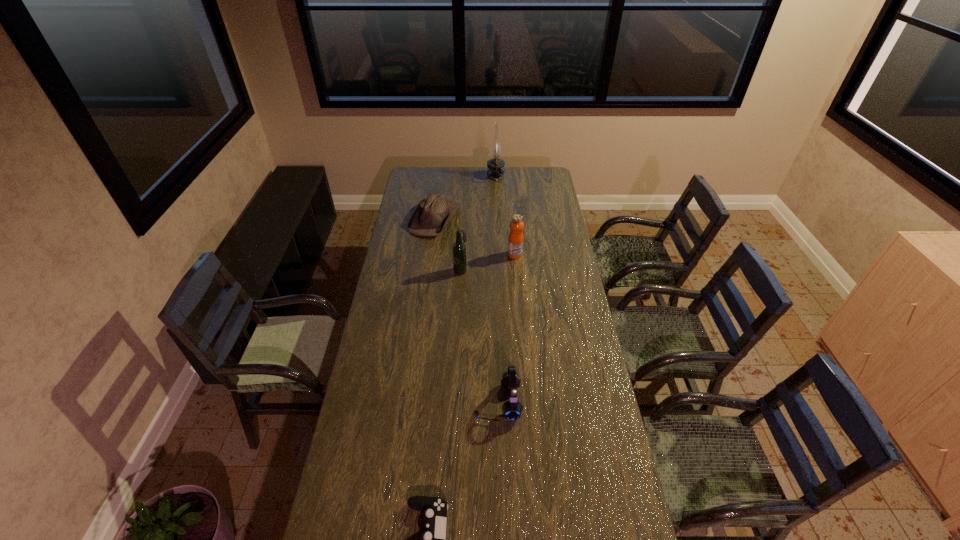
At what (x,y) coordinates should I click in order to perform the action: click on oil lamp. Please return your answer as a coordinate pair (x, y). Looking at the image, I should click on (495, 170).

Find the location of a particular element. the tallest object is located at coordinates (495, 170).

At what (x,y) coordinates should I click in order to perform the action: click on beer bottle. Please return your answer as a coordinate pair (x, y). Looking at the image, I should click on (459, 249).

Where is `fruit juice`? This screenshot has width=960, height=540. fruit juice is located at coordinates (515, 242).

Identify the location of headset. (512, 409).

You are a GUI agent. You are given a task and a screenshot of the screen. Output one action in this format:
    pyautogui.click(x=<x>, y=<y>)
    Task: Click on the fifth farthest object
    Image resolution: width=960 pixels, height=540 pixels.
    Given the screenshot: What is the action you would take?
    pyautogui.click(x=512, y=409)

The image size is (960, 540). I want to click on the fifth nearest object, so click(432, 215).

Locate an element on the screen. fedora is located at coordinates (432, 215).

The width and height of the screenshot is (960, 540). Find the location of `free space located on the front of the oil lamp`. free space located on the front of the oil lamp is located at coordinates (497, 208).

This screenshot has width=960, height=540. What are the coordinates of `free location located on the right of the fourth farthest object` in the screenshot? It's located at (533, 270).